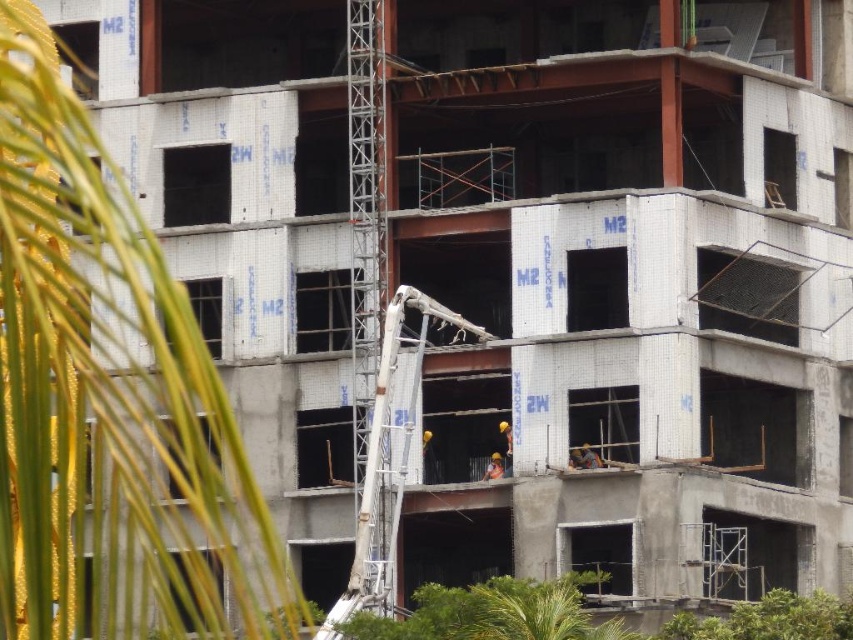
You are a safety inspector evaluating the construction site. You notice the white concrete ladder at center and the hard hat construction worker at center. Which object is wider in terms of their physical dimensions?

The white concrete ladder at center is wider than the hard hat construction worker at center, as its width surpasses that of the worker.

You are standing at the center of the image and want to walk towards the green leafy palm tree at left. Which direction should you turn to face the palm tree?

Since the green leafy palm tree at left is located at point 0.627 on the x axis and 0.129 on the y axis, you should turn to your left to face it because it is positioned to the left side of the image.